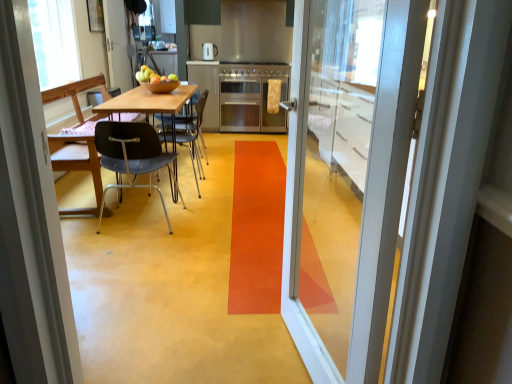
This screenshot has height=384, width=512. Identify the location of free space to the right of black plastic chair at left, the second chair viewed from the left. (213, 216).